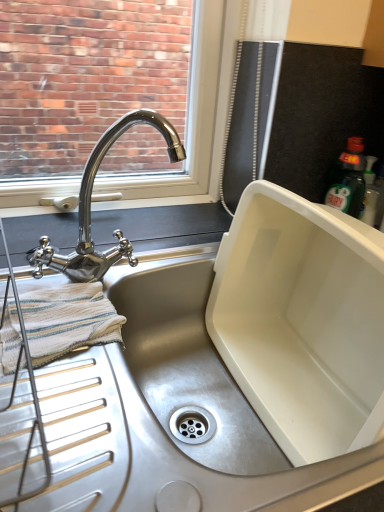
Question: Can you confirm if polished chrome tap at upper left is smaller than white striped cloth at left?

Choices:
 (A) yes
 (B) no

Answer: (B)

Question: Is polished chrome tap at upper left positioned before white striped cloth at left?

Choices:
 (A) yes
 (B) no

Answer: (A)

Question: Is polished chrome tap at upper left shorter than white striped cloth at left?

Choices:
 (A) no
 (B) yes

Answer: (A)

Question: Can you confirm if polished chrome tap at upper left is positioned to the right of white striped cloth at left?

Choices:
 (A) yes
 (B) no

Answer: (A)

Question: Are polished chrome tap at upper left and white striped cloth at left beside each other?

Choices:
 (A) yes
 (B) no

Answer: (B)

Question: From the image's perspective, is polished chrome tap at upper left over white striped cloth at left?

Choices:
 (A) no
 (B) yes

Answer: (B)

Question: Is white striped cloth at left closer to camera compared to polished chrome tap at upper left?

Choices:
 (A) no
 (B) yes

Answer: (A)

Question: From a real-world perspective, is white striped cloth at left beneath polished chrome tap at upper left?

Choices:
 (A) yes
 (B) no

Answer: (A)

Question: Can you confirm if white striped cloth at left is positioned to the left of polished chrome tap at upper left?

Choices:
 (A) yes
 (B) no

Answer: (A)

Question: From the image's perspective, is white striped cloth at left beneath polished chrome tap at upper left?

Choices:
 (A) no
 (B) yes

Answer: (B)

Question: Does white striped cloth at left have a lesser height compared to polished chrome tap at upper left?

Choices:
 (A) yes
 (B) no

Answer: (A)

Question: Can polished chrome tap at upper left be found inside white striped cloth at left?

Choices:
 (A) no
 (B) yes

Answer: (A)

Question: From a real-world perspective, is white striped cloth at left positioned above or below polished chrome tap at upper left?

Choices:
 (A) below
 (B) above

Answer: (A)